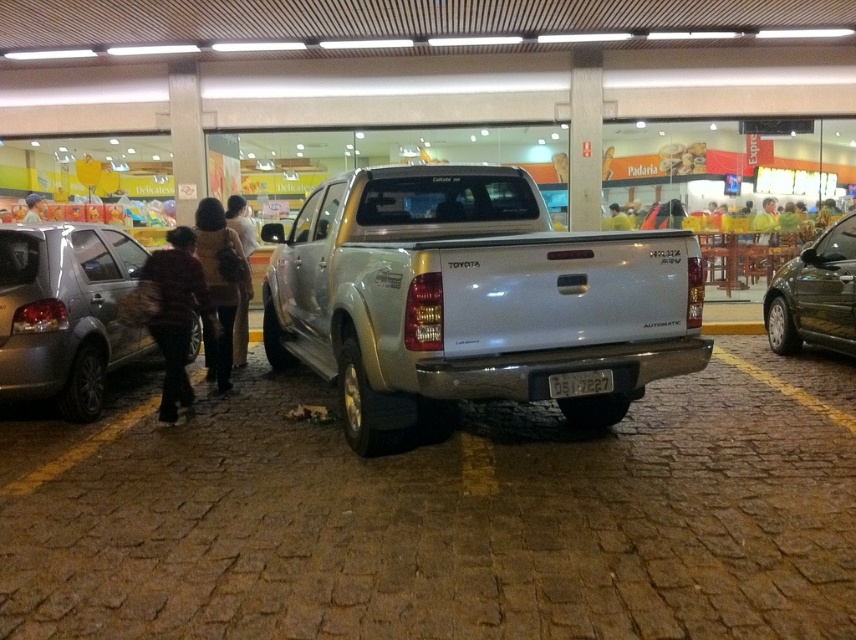
Does shiny dark green car at right have a smaller size compared to brown fabric bag at lower left?

Actually, shiny dark green car at right might be larger than brown fabric bag at lower left.

Is point (848, 289) positioned in front of point (193, 248)?

No, (848, 289) is further to viewer.

At what (x,y) coordinates should I click in order to perform the action: click on shiny dark green car at right. Please return your answer as a coordinate pair (x, y). Looking at the image, I should click on (815, 294).

At what (x,y) coordinates should I click in order to perform the action: click on shiny dark green car at right. Please return your answer as a coordinate pair (x, y). The height and width of the screenshot is (640, 856). Looking at the image, I should click on (815, 294).

Based on the photo, can you confirm if silver metallic pickup truck at center is positioned to the left of black plastic license plate at center?

Indeed, silver metallic pickup truck at center is positioned on the left side of black plastic license plate at center.

Based on the photo, measure the distance between point (x=502, y=268) and camera.

Point (x=502, y=268) is 3.78 meters from camera.

Image resolution: width=856 pixels, height=640 pixels. What are the coordinates of `silver metallic pickup truck at center` in the screenshot? It's located at (471, 298).

Which is more to the left, silver metallic hatchback at left or light brown leather jacket at left?

From the viewer's perspective, light brown leather jacket at left appears more on the left side.

Based on the photo, who is more distant from viewer, (86,314) or (43,204)?

The point (43,204) is behind.

Is point (119, 330) closer to viewer compared to point (25, 211)?

Yes, it is in front of point (25, 211).

Where is `silver metallic hatchback at left`? The image size is (856, 640). silver metallic hatchback at left is located at coordinates (64, 312).